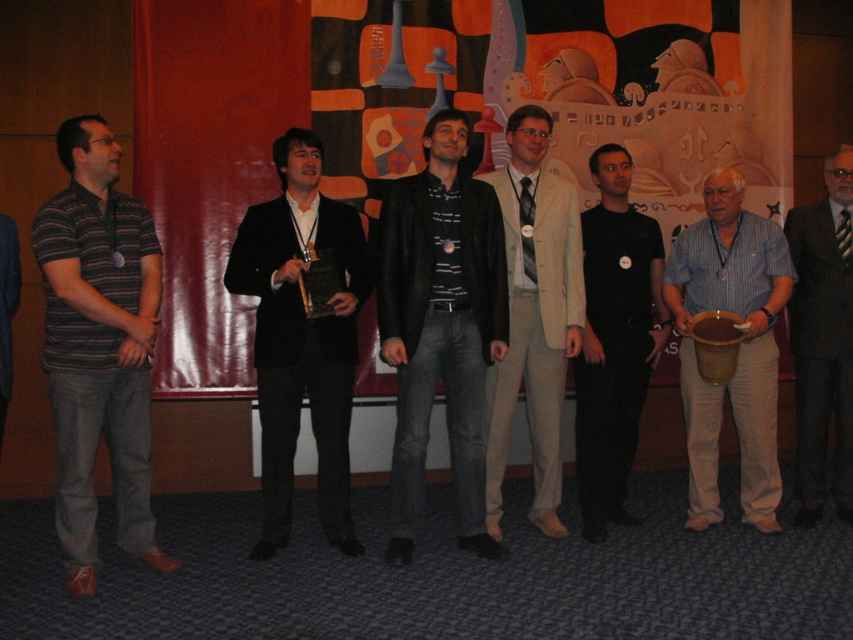
From the picture: You are standing at the entrance of the room and want to greet the person wearing the black matte suit at center and the person in the blue striped shirt at right. Which one should you approach first if you want to greet the person closer to you?

The black matte suit at center is closer to the viewer, so you should approach the person wearing the black matte suit at center first.

You are organizing a photo shoot and want to ensure that the beige fabric suit at center and the striped shirt at center are positioned closer together for a group photo. Given that they are currently 4.11 feet apart, what is the minimum distance you should move one of them to achieve a desired separation of 2 feet between them?

To reduce the distance between the beige fabric suit at center and the striped shirt at center from 4.11 feet to 2 feet, you need to move one of them by 2.11 feet closer to the other.